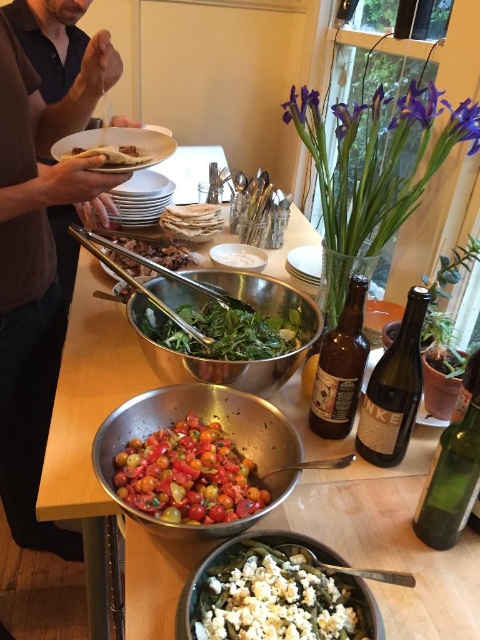
Which of these two, metallic silver bowl at center or translucent glass bottle at center right, stands taller?

With more height is metallic silver bowl at center.

Does metallic silver bowl at center have a lesser width compared to translucent glass bottle at center right?

Incorrect, metallic silver bowl at center's width is not less than translucent glass bottle at center right's.

Describe the element at coordinates (392, 540) in the screenshot. I see `metallic silver bowl at center` at that location.

Find the location of a particular element. metallic silver bowl at center is located at coordinates (392, 540).

Between green leafymaterial/texture at lower center and brown glass bottle at center, which one appears on the left side from the viewer's perspective?

Positioned to the left is green leafymaterial/texture at lower center.

Between point (228, 604) and point (339, 392), which one is positioned behind?

The point (339, 392) is more distant.

Identify the location of green leafymaterial/texture at lower center. (276, 596).

Does brown leather shirt at left have a smaller size compared to green leafymaterial/texture at lower center?

No.

Which of these two, brown leather shirt at left or green leafymaterial/texture at lower center, stands shorter?

With less height is green leafymaterial/texture at lower center.

At what (x,y) coordinates should I click in order to perform the action: click on brown leather shirt at left. Please return your answer as a coordinate pair (x, y). This screenshot has height=640, width=480. Looking at the image, I should click on tap(40, 248).